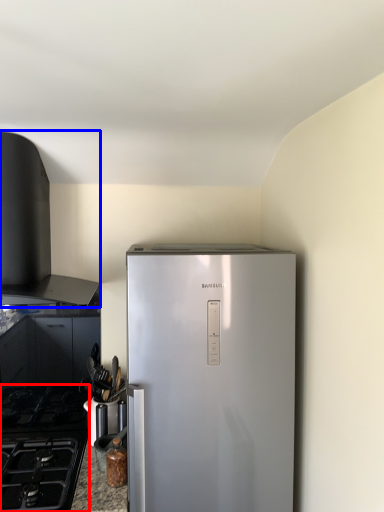
Question: Which object appears closest to the camera in this image, gas stove (highlighted by a red box) or vent (highlighted by a blue box)?

Choices:
 (A) gas stove
 (B) vent

Answer: (A)